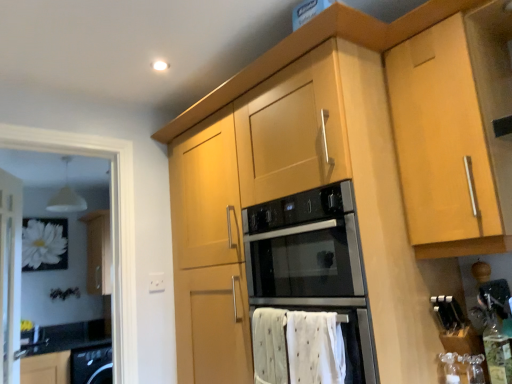
Question: From a real-world perspective, is white plastic electric outlet at lower center located higher than white cotton bath towel at lower center?

Choices:
 (A) yes
 (B) no

Answer: (A)

Question: Is white plastic electric outlet at lower center positioned before white cotton bath towel at lower center?

Choices:
 (A) no
 (B) yes

Answer: (A)

Question: Is white plastic electric outlet at lower center wider than white cotton bath towel at lower center?

Choices:
 (A) yes
 (B) no

Answer: (B)

Question: Is white plastic electric outlet at lower center further to the viewer compared to white cotton bath towel at lower center?

Choices:
 (A) no
 (B) yes

Answer: (B)

Question: Does white plastic electric outlet at lower center have a smaller size compared to white cotton bath towel at lower center?

Choices:
 (A) no
 (B) yes

Answer: (B)

Question: Do you think white glossy screen door at left is within white cotton bath towel at lower center, or outside of it?

Choices:
 (A) outside
 (B) inside

Answer: (A)

Question: Considering the positions of white glossy screen door at left and white cotton bath towel at lower center in the image, is white glossy screen door at left taller or shorter than white cotton bath towel at lower center?

Choices:
 (A) tall
 (B) short

Answer: (A)

Question: From a real-world perspective, is white glossy screen door at left physically located above or below white cotton bath towel at lower center?

Choices:
 (A) below
 (B) above

Answer: (B)

Question: In the image, is white glossy screen door at left positioned in front of or behind white cotton bath towel at lower center?

Choices:
 (A) behind
 (B) front

Answer: (A)

Question: From their relative heights in the image, would you say white glossy sink at lower left is taller or shorter than white plastic electric outlet at lower center?

Choices:
 (A) tall
 (B) short

Answer: (A)

Question: From the image's perspective, is white glossy sink at lower left located above or below white plastic electric outlet at lower center?

Choices:
 (A) above
 (B) below

Answer: (B)

Question: From a real-world perspective, relative to white plastic electric outlet at lower center, is white glossy sink at lower left vertically above or below?

Choices:
 (A) above
 (B) below

Answer: (B)

Question: Is point (35, 340) positioned closer to the camera than point (155, 271)?

Choices:
 (A) farther
 (B) closer

Answer: (A)

Question: Is point (42, 331) positioned closer to the camera than point (434, 246)?

Choices:
 (A) closer
 (B) farther

Answer: (B)

Question: From the image's perspective, relative to light wood cabinet at center, is white glossy sink at lower left above or below?

Choices:
 (A) above
 (B) below

Answer: (B)